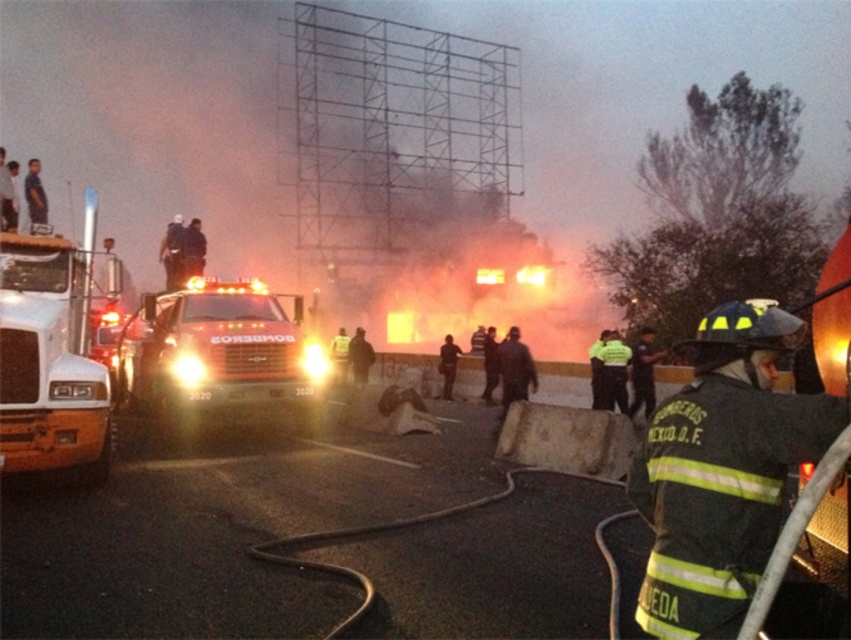
Can you confirm if dark green reflective uniform at center is positioned to the left of white glossy fire truck at left?

No, dark green reflective uniform at center is not to the left of white glossy fire truck at left.

Does dark green reflective uniform at center have a larger size compared to white glossy fire truck at left?

Incorrect, dark green reflective uniform at center is not larger than white glossy fire truck at left.

Does point (737, 600) come closer to viewer compared to point (92, 205)?

Yes.

At what (x,y) coordinates should I click in order to perform the action: click on dark green reflective uniform at center. Please return your answer as a coordinate pair (x, y). The image size is (851, 640). Looking at the image, I should click on (722, 472).

Which is below, dark green reflective uniform at center or shiny silver fire truck at center?

shiny silver fire truck at center is below.

Does dark green reflective uniform at center have a larger size compared to shiny silver fire truck at center?

No, dark green reflective uniform at center is not bigger than shiny silver fire truck at center.

The width and height of the screenshot is (851, 640). In order to click on dark green reflective uniform at center in this screenshot , I will do `click(722, 472)`.

Is point (283, 364) closer to viewer compared to point (12, 465)?

That is False.

Does shiny silver fire truck at center have a lesser height compared to white glossy fire truck at left?

Yes.

Identify the location of shiny silver fire truck at center. (216, 356).